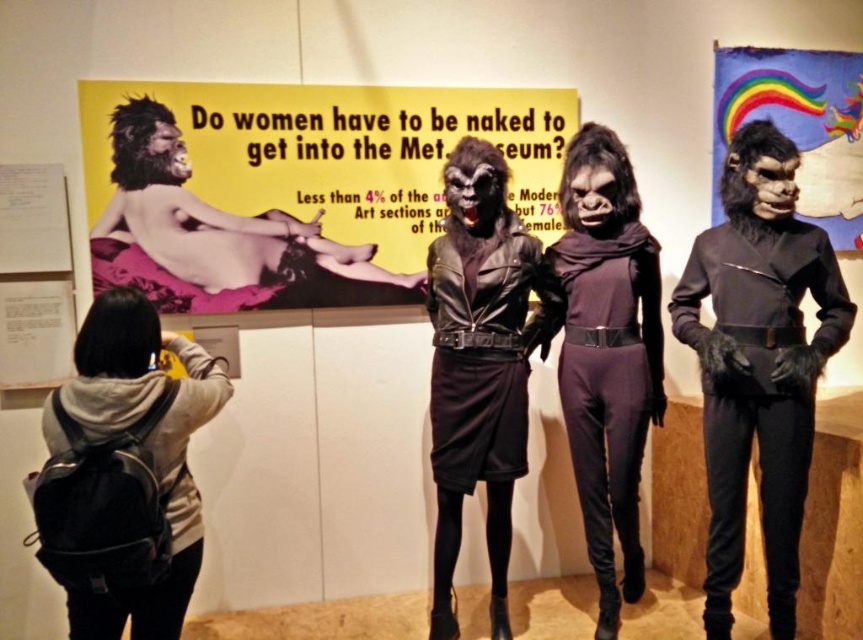
You are an art student visiting the museum and need to take a photo of both the rainbow fabric poster at upper right and the black leather backpack at lower left. Which object should you zoom in more on to capture its details clearly?

The rainbow fabric poster at upper right has a smaller size compared to the black leather backpack at lower left, so you should zoom in more on the rainbow fabric poster at upper right to capture its details clearly.

You are an art critic standing in front of the Met exhibit. You notice two points marked on the wall. The first point is at coordinate (564,401) and the second is at (439,433). Which point is closer to you?

Point (564,401) is closer to you because it is further to the viewer than point (439,433).